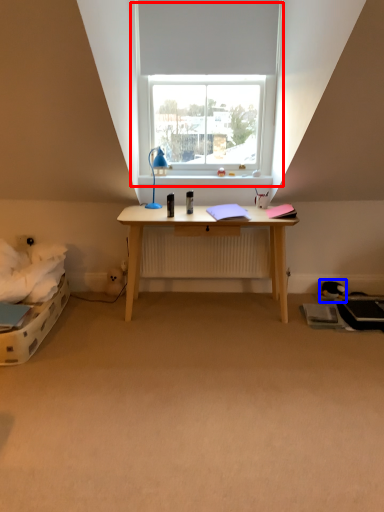
Question: Among these objects, which one is nearest to the camera, window (highlighted by a red box) or toy (highlighted by a blue box)?

Choices:
 (A) window
 (B) toy

Answer: (A)